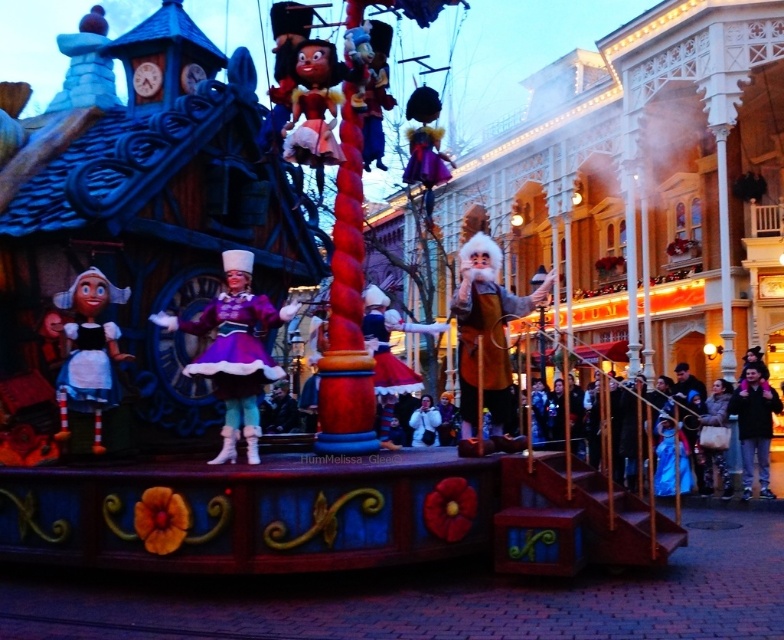
You are a photographer at the parade and want to capture both the matte purple fabric dress at center and the black leather jacket at lower right in the same frame. Given their sizes, which one should you focus on to ensure both are visible without cropping?

The matte purple fabric dress at center is larger than the black leather jacket at lower right. To ensure both are visible without cropping, focus on the larger matte purple fabric dress at center and adjust the framing to include the smaller black leather jacket at lower right.